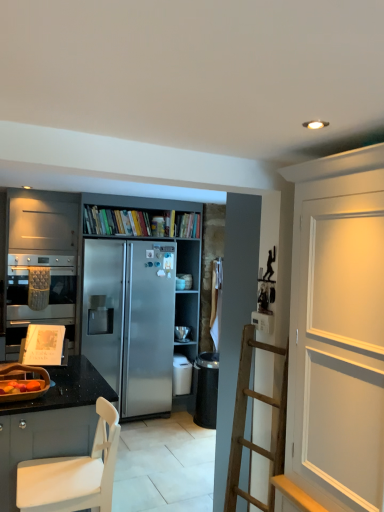
Question: Is matte silver oven at left further to the viewer compared to black granite countertop at lower left, arranged as the 2th cabinetry when viewed from the back?

Choices:
 (A) yes
 (B) no

Answer: (A)

Question: Is matte silver oven at left turned away from black granite countertop at lower left, arranged as the 2th cabinetry when viewed from the back?

Choices:
 (A) no
 (B) yes

Answer: (A)

Question: Does matte silver oven at left have a smaller size compared to black granite countertop at lower left, arranged as the 2th cabinetry when viewed from the back?

Choices:
 (A) no
 (B) yes

Answer: (B)

Question: Is matte silver oven at left taller than black granite countertop at lower left, the first cabinetry from the front?

Choices:
 (A) yes
 (B) no

Answer: (B)

Question: Is matte silver oven at left at the left side of black granite countertop at lower left, arranged as the 2th cabinetry when viewed from the back?

Choices:
 (A) no
 (B) yes

Answer: (B)

Question: Is satin silver refrigerator at center, placed as the 1th appliance when sorted from back to front, in front of or behind black granite countertop at lower left, arranged as the 2th cabinetry when viewed from the back, in the image?

Choices:
 (A) front
 (B) behind

Answer: (B)

Question: Looking at their shapes, would you say satin silver refrigerator at center, positioned as the first appliance in right-to-left order, is wider or thinner than black granite countertop at lower left, the first cabinetry from the front?

Choices:
 (A) thin
 (B) wide

Answer: (A)

Question: Looking at the image, does satin silver refrigerator at center, placed as the 1th appliance when sorted from back to front, seem bigger or smaller compared to black granite countertop at lower left, the first cabinetry from the front?

Choices:
 (A) small
 (B) big

Answer: (A)

Question: In the image, is satin silver refrigerator at center, arranged as the 2th appliance when viewed from the top, on the left side or the right side of black granite countertop at lower left, arranged as the 2th cabinetry when viewed from the back?

Choices:
 (A) left
 (B) right

Answer: (B)

Question: Choose the correct answer: Is wooden fruit basket at lower left, marked as the 1th appliance in a left-to-right arrangement, inside satin silver refrigerator at center, the first appliance in the bottom-to-top sequence, or outside it?

Choices:
 (A) outside
 (B) inside

Answer: (A)

Question: From a real-world perspective, relative to satin silver refrigerator at center, the first appliance in the bottom-to-top sequence, is wooden fruit basket at lower left, which ranks as the 3th appliance in right-to-left order, vertically above or below?

Choices:
 (A) below
 (B) above

Answer: (B)

Question: Is wooden fruit basket at lower left, the third appliance positioned from the bottom, wider or thinner than satin silver refrigerator at center, which ranks as the 2th appliance in back-to-front order?

Choices:
 (A) wide
 (B) thin

Answer: (B)

Question: Based on their sizes in the image, would you say wooden fruit basket at lower left, arranged as the first appliance when viewed from the top, is bigger or smaller than satin silver refrigerator at center, which ranks as the 2th appliance in back-to-front order?

Choices:
 (A) small
 (B) big

Answer: (A)

Question: From a real-world perspective, is wooden fruit basket at lower left, marked as the 1th appliance in a left-to-right arrangement, positioned above or below black granite countertop at lower left, the first cabinetry from the front?

Choices:
 (A) below
 (B) above

Answer: (B)

Question: Is point (6, 369) positioned closer to the camera than point (18, 407)?

Choices:
 (A) closer
 (B) farther

Answer: (B)